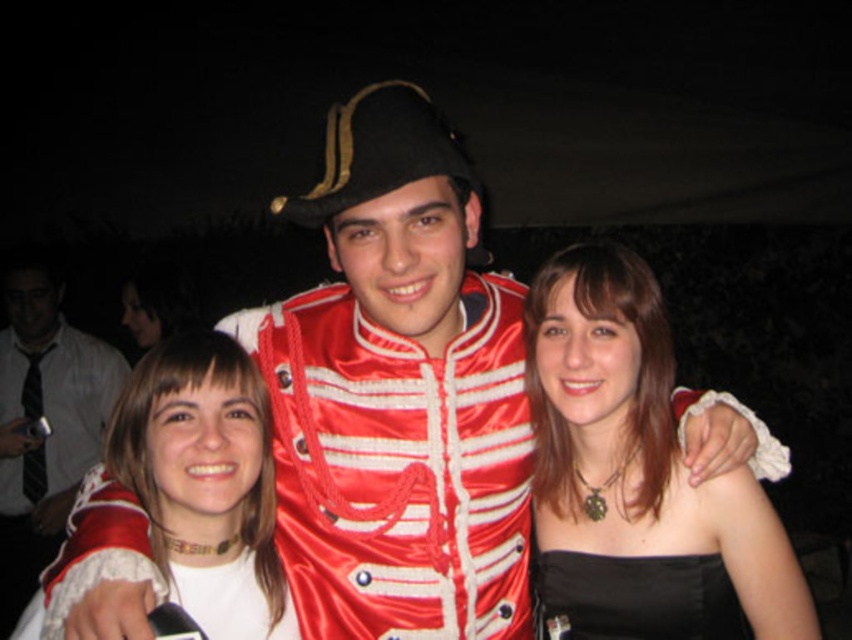
Question: In this image, where is white satin blouse at left located relative to black satin dress at lower right?

Choices:
 (A) below
 (B) above

Answer: (B)

Question: Which point is farther from the camera taking this photo?

Choices:
 (A) (661, 573)
 (B) (229, 376)

Answer: (A)

Question: Which object is positioned farthest from the white satin blouse at left?

Choices:
 (A) black satin dress at center
 (B) black satin dress at lower right
 (C) matte white lace at left

Answer: (C)

Question: Can you confirm if black satin dress at center is positioned above white satin blouse at left?

Choices:
 (A) no
 (B) yes

Answer: (B)

Question: Which point is closer to the camera?

Choices:
 (A) white satin blouse at left
 (B) black satin dress at center

Answer: (A)

Question: Where is black satin dress at center located in relation to matte white lace at left in the image?

Choices:
 (A) above
 (B) below

Answer: (A)